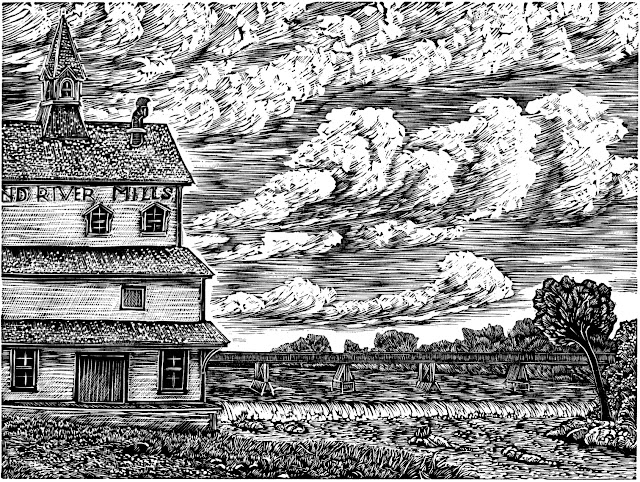
Find the location of a particular element. Image resolution: width=640 pixels, height=482 pixels. window is located at coordinates coord(137,302).